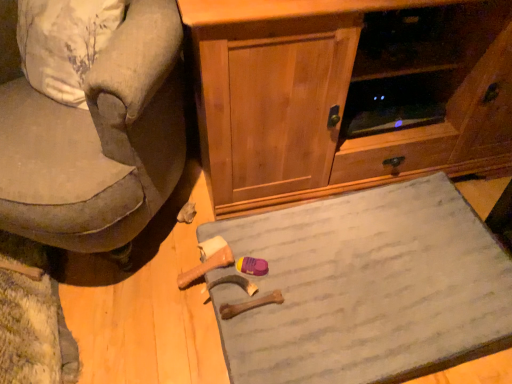
Question: Considering the positions of point (368, 350) and point (141, 56), is point (368, 350) closer or farther from the camera than point (141, 56)?

Choices:
 (A) farther
 (B) closer

Answer: (A)

Question: From the image's perspective, is gray fabric doormat at lower center located above or below velvet gray armchair at left?

Choices:
 (A) below
 (B) above

Answer: (A)

Question: Estimate the real-world distances between objects in this image. Which object is closer to the wooden cabinet at center?

Choices:
 (A) velvet gray armchair at left
 (B) gray fabric doormat at lower center

Answer: (B)

Question: Estimate the real-world distances between objects in this image. Which object is farther from the gray fabric doormat at lower center?

Choices:
 (A) wooden cabinet at center
 (B) velvet gray armchair at left

Answer: (B)